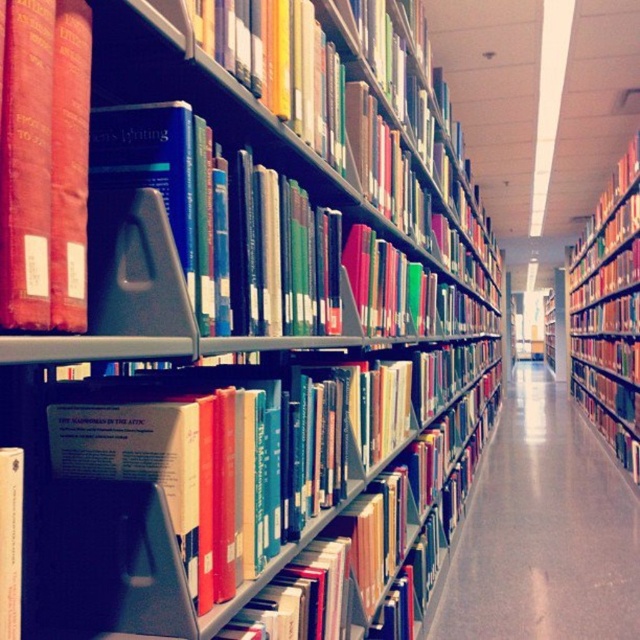
Question: Based on their relative distances, which object is nearer to the smooth concrete floor at center?

Choices:
 (A) hardcover book at center
 (B) matte red book at left
 (C) red matte bookcase at right

Answer: (C)

Question: Which point is farther to the camera?

Choices:
 (A) matte red book at left
 (B) smooth concrete floor at center
 (C) hardcover book at center
 (D) red matte bookcase at right

Answer: (D)

Question: In this image, where is smooth concrete floor at center located relative to hardcover book at center?

Choices:
 (A) above
 (B) below

Answer: (B)

Question: Does smooth concrete floor at center appear under red matte bookcase at right?

Choices:
 (A) no
 (B) yes

Answer: (B)

Question: Is matte red book at left in front of hardcover book at center?

Choices:
 (A) no
 (B) yes

Answer: (A)

Question: Which point is farther to the camera?

Choices:
 (A) 19,188
 (B) 618,362

Answer: (B)